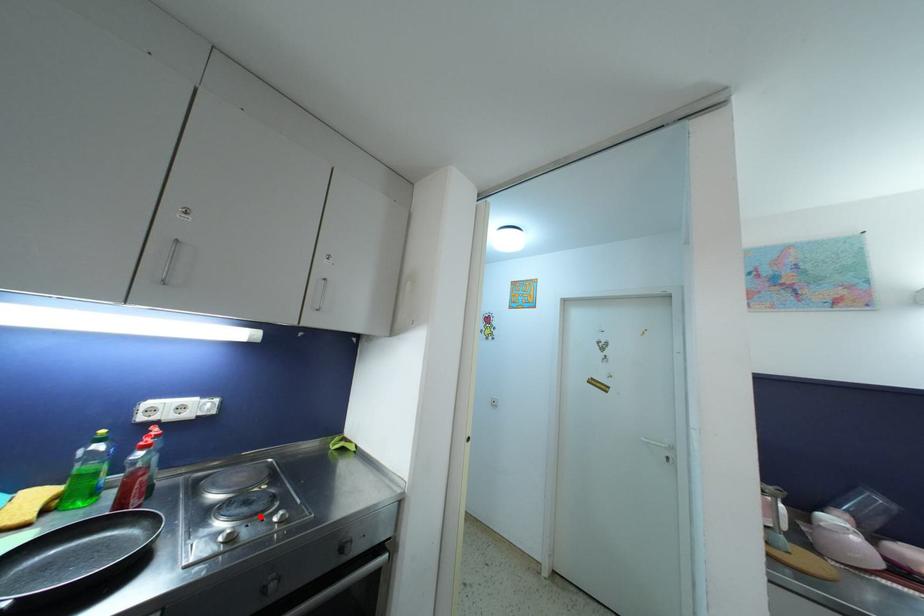
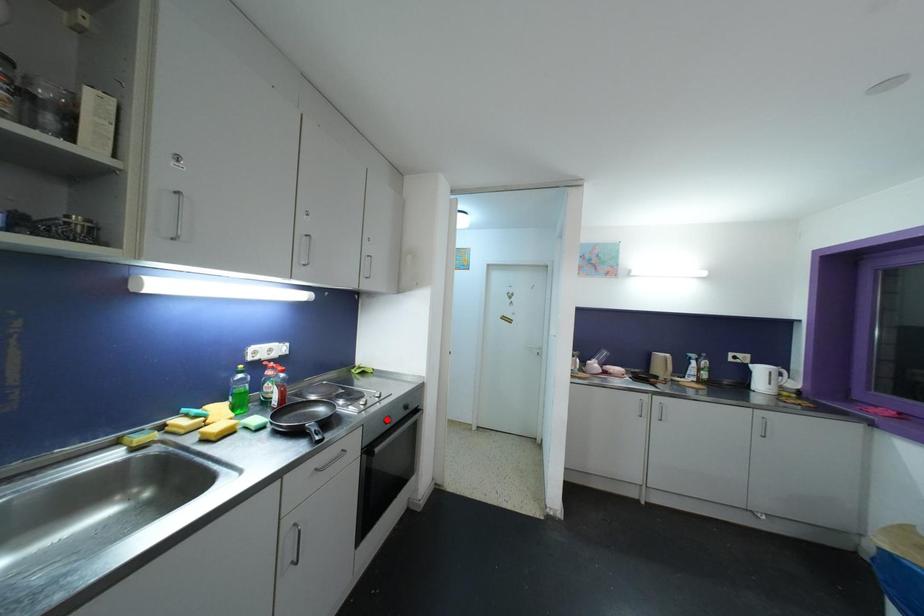
I am providing you with two images of the same scene from different viewpoints. A red point is marked on the first image and another point is marked on the second image. Is the marked point in image1 the same physical position as the marked point in image2?

No